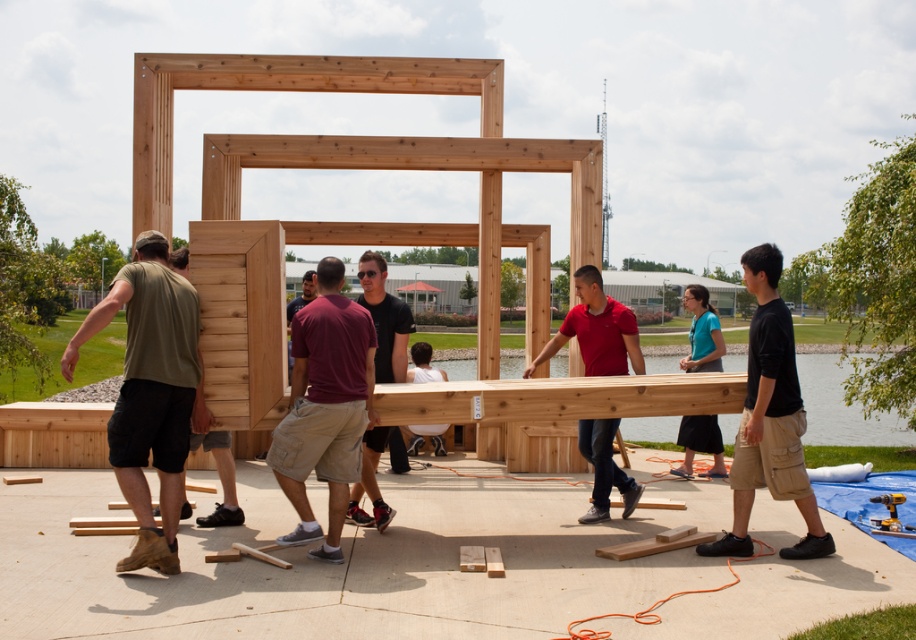
You are a photographer standing at the edge of the park, observing the scene. You need to capture a clear photo of both the maroon fabric shirt at center and the matte black shirt at center. Which shirt will appear larger in the photo?

The maroon fabric shirt at center will appear larger in the photo because it is larger in size than the matte black shirt at center.

Consider the image. You are standing in the park and see a point marked at coordinates (173, 403). If you want to place a 6 meter long wooden beam exactly at that point, will it fit without overlapping anything?

The point at coordinates (173, 403) is 5.57 meters away from the viewer. Since the beam is 6 meters long, placing it at that point would require more space than available, so it won